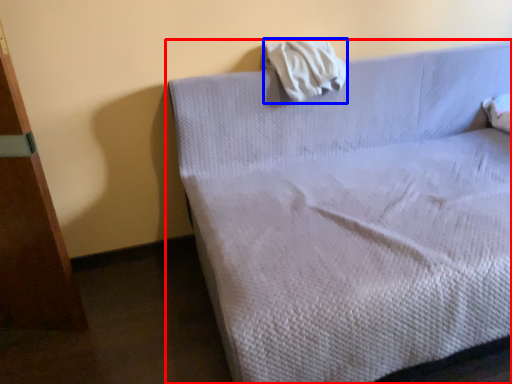
Question: Which object appears farthest to the camera in this image, bed (highlighted by a red box) or cloth (highlighted by a blue box)?

Choices:
 (A) bed
 (B) cloth

Answer: (B)